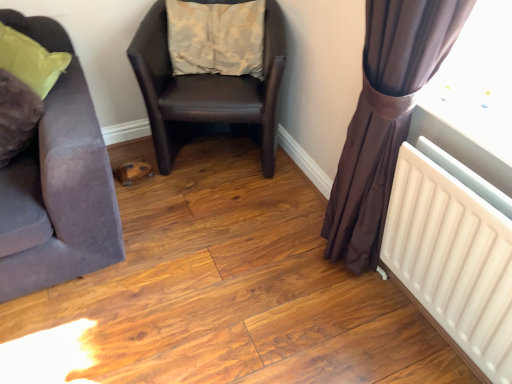
Where is `free location in front of brown sheer curtain at right`? free location in front of brown sheer curtain at right is located at coordinates (344, 346).